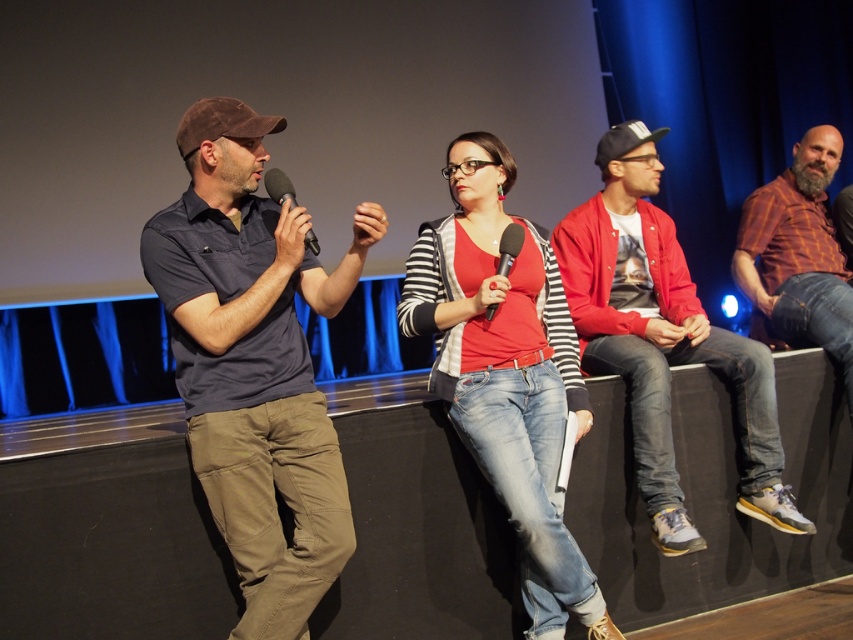
Is matte red shirt at center behind red cotton jacket at right?

No, it is in front of red cotton jacket at right.

The image size is (853, 640). What do you see at coordinates (506, 372) in the screenshot?
I see `matte red shirt at center` at bounding box center [506, 372].

Is point (448, 388) less distant than point (647, 237)?

Yes, point (448, 388) is closer to viewer.

The width and height of the screenshot is (853, 640). Find the location of `matte red shirt at center`. matte red shirt at center is located at coordinates (506, 372).

Does matte red shirt at center lie behind plaid shirt at right?

No.

Can you confirm if matte red shirt at center is positioned below plaid shirt at right?

Yes, matte red shirt at center is below plaid shirt at right.

Which is in front, point (440, 305) or point (831, 266)?

Point (440, 305) is more forward.

I want to click on matte red shirt at center, so click(506, 372).

Does dark blue cotton shirt at left appear on the right side of plaid shirt at right?

No, dark blue cotton shirt at left is not to the right of plaid shirt at right.

Which is in front, point (242, 337) or point (821, 259)?

Point (242, 337) is more forward.

At what (x,y) coordinates should I click in order to perform the action: click on dark blue cotton shirt at left. Please return your answer as a coordinate pair (x, y). The width and height of the screenshot is (853, 640). Looking at the image, I should click on (254, 362).